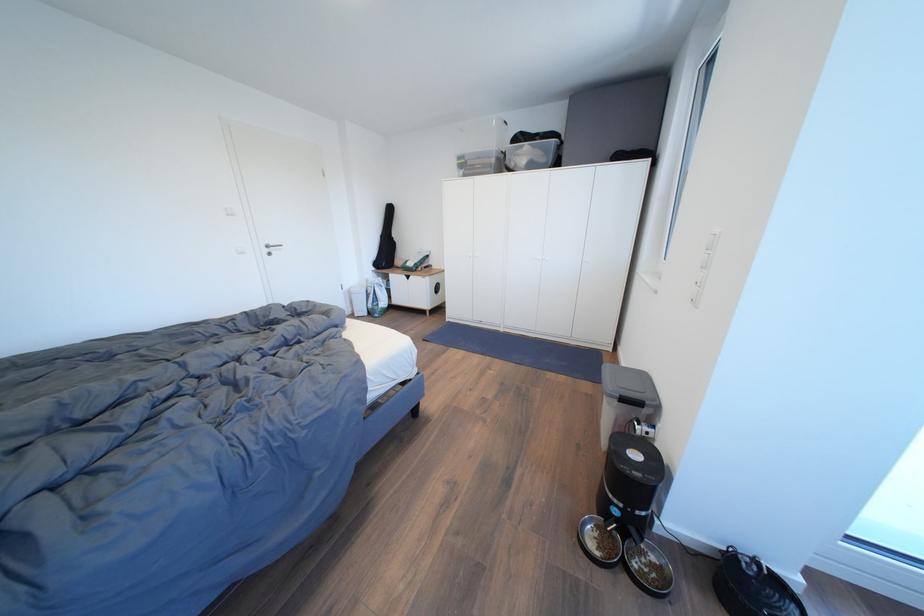
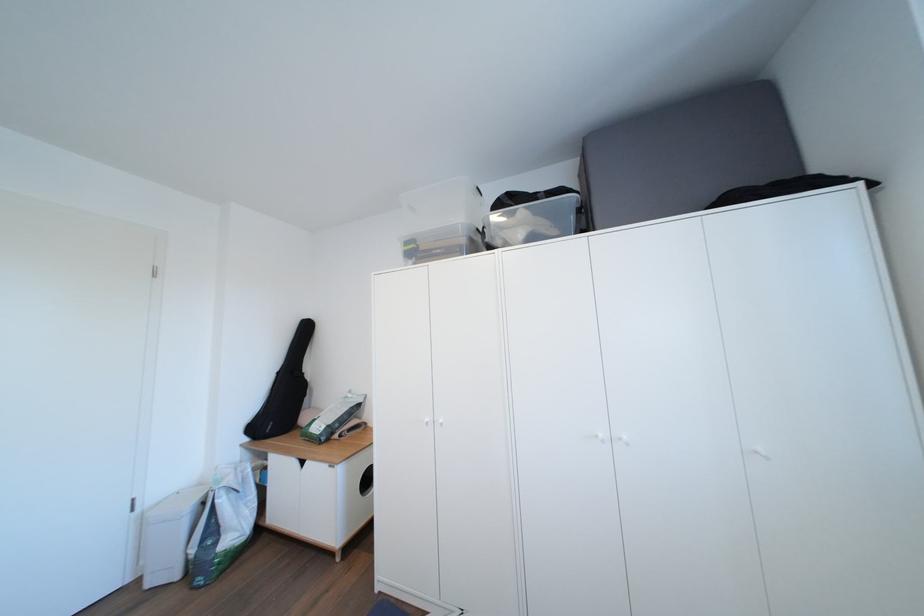
Find the pixel in the second image that matches point 476,168 in the first image.

(429, 254)